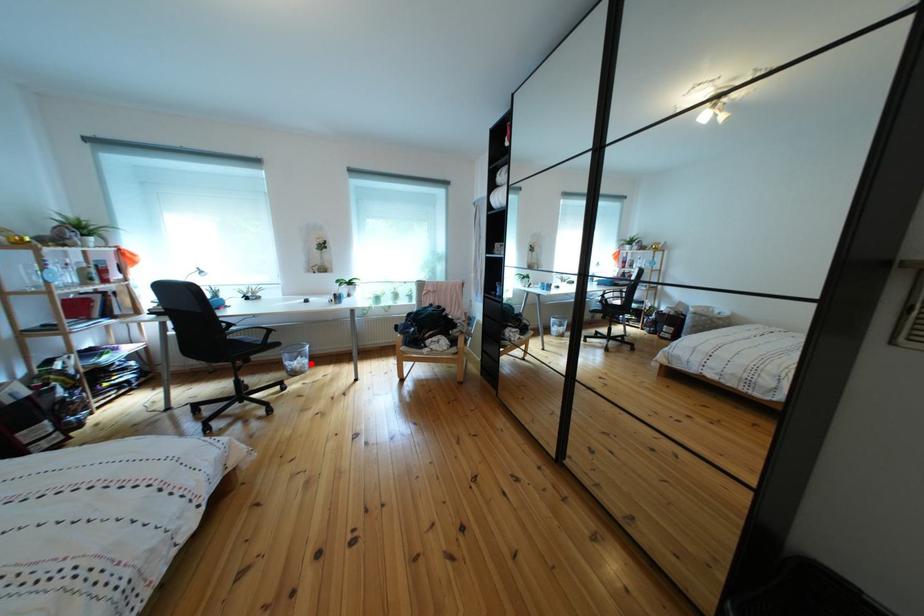
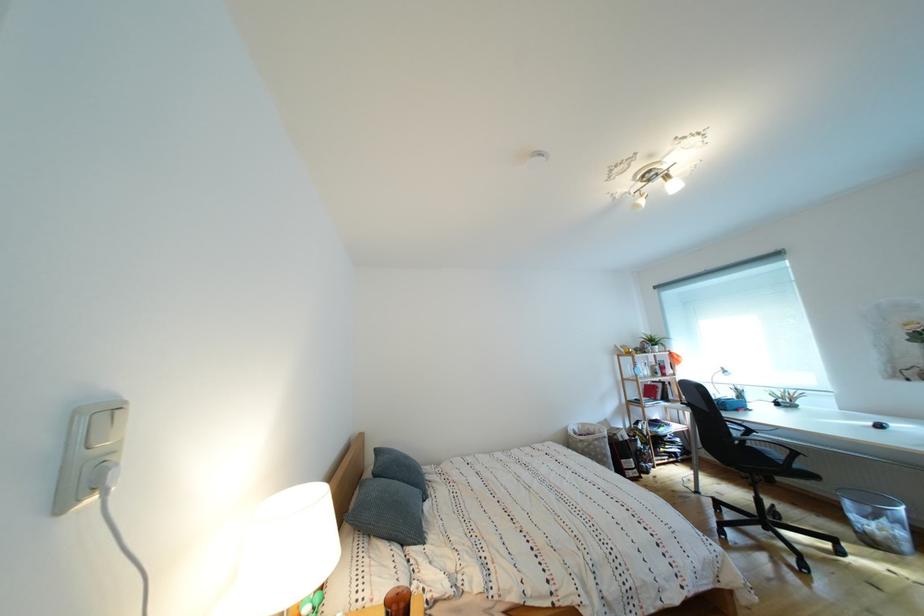
Question: I am providing you with two images of the same scene from different viewpoints. Image1 has a red point marked. In image2, the corresponding 3D location appears at what relative position? Reply with the corresponding letter.

Choices:
 (A) Closer
 (B) Farther

Answer: (A)